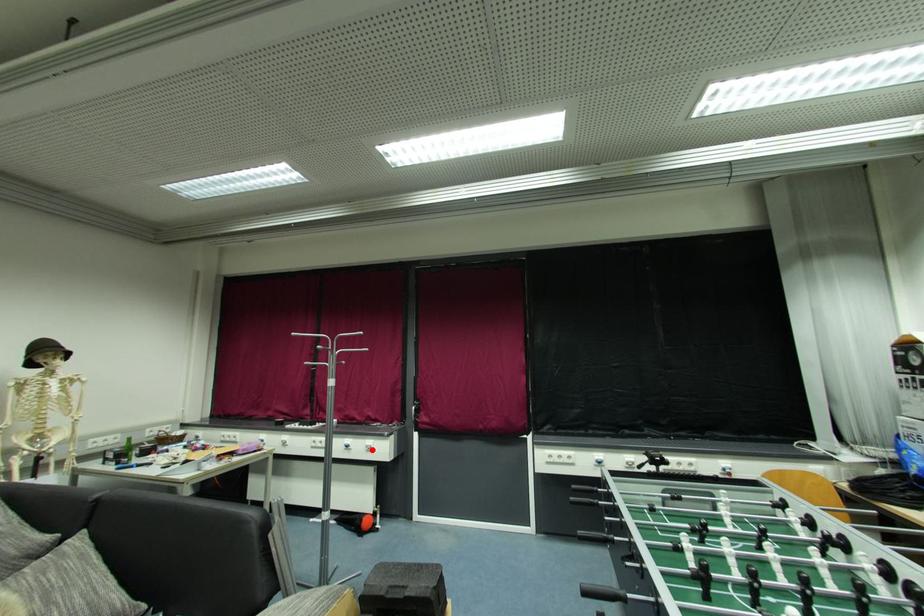
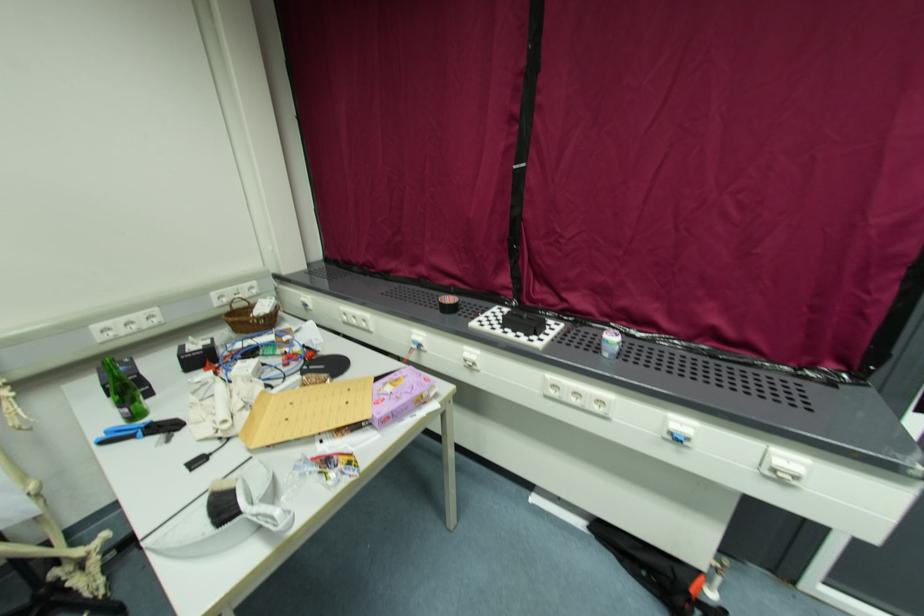
Question: I am providing you with two images of the same scene from different viewpoints. Given a red point in image1, look at the same physical point in image2. Is it:

Choices:
 (A) Closer to the viewpoint
 (B) Farther from the viewpoint

Answer: (A)